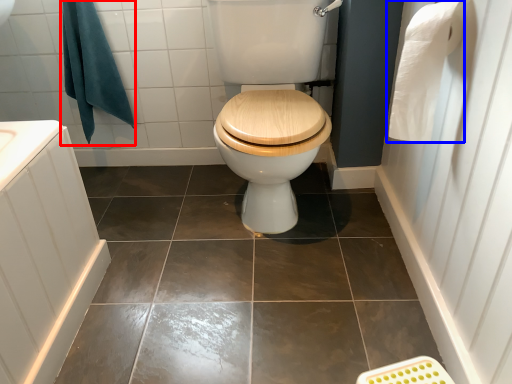
Question: Which point is closer to the camera, bath towel (highlighted by a red box) or toilet paper (highlighted by a blue box)?

Choices:
 (A) bath towel
 (B) toilet paper

Answer: (B)